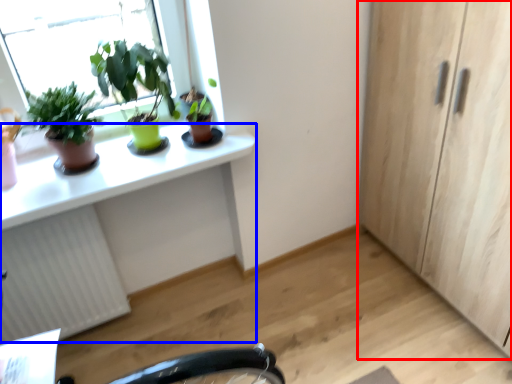
Question: Which object appears farthest to the camera in this image, cabinetry (highlighted by a red box) or computer desk (highlighted by a blue box)?

Choices:
 (A) cabinetry
 (B) computer desk

Answer: (A)